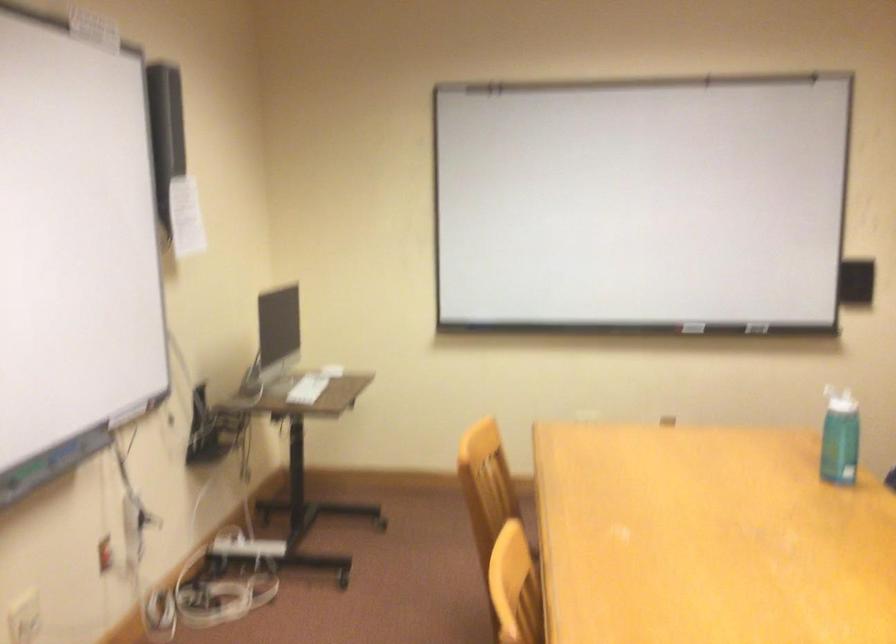
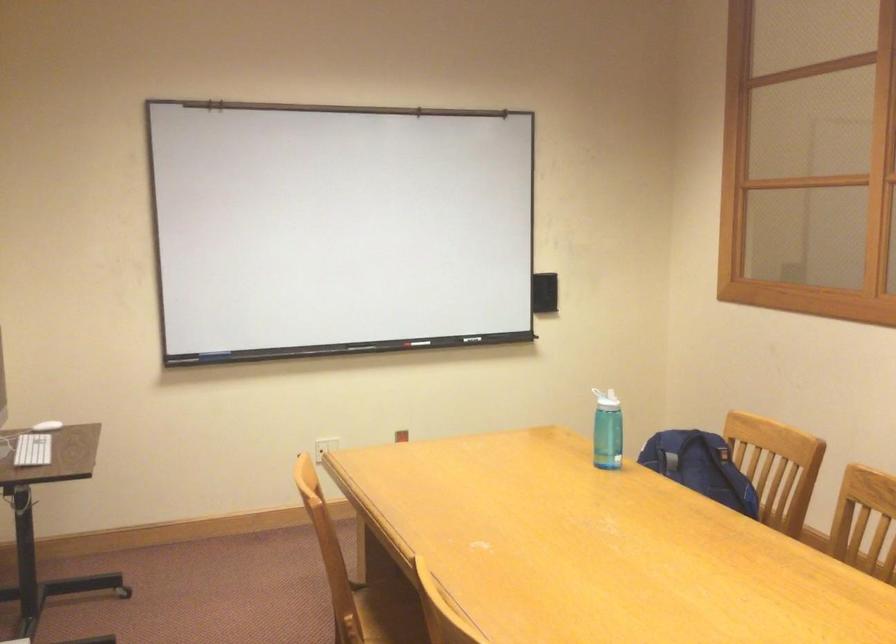
The point at [802,333] is marked in the first image. Where is the corresponding point in the second image?

(476, 339)